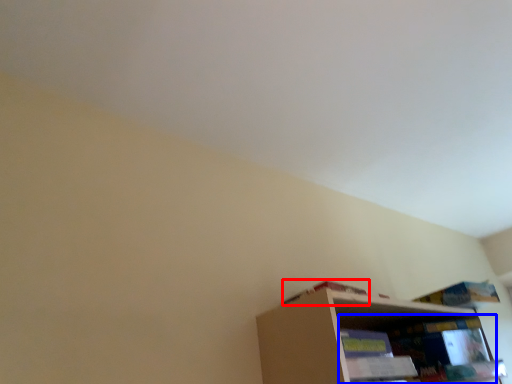
Question: Which object is closer to the camera taking this photo, book (highlighted by a red box) or shelf (highlighted by a blue box)?

Choices:
 (A) book
 (B) shelf

Answer: (A)